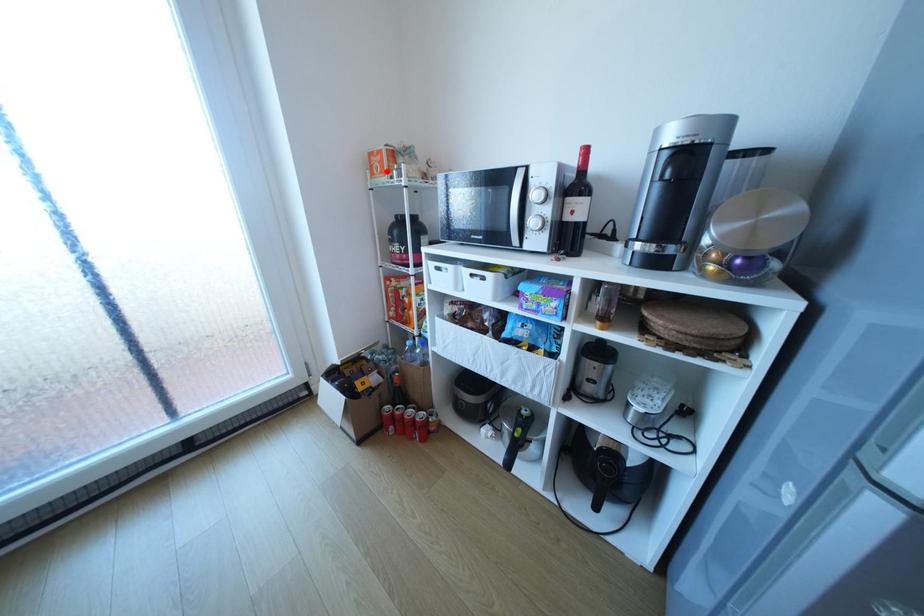
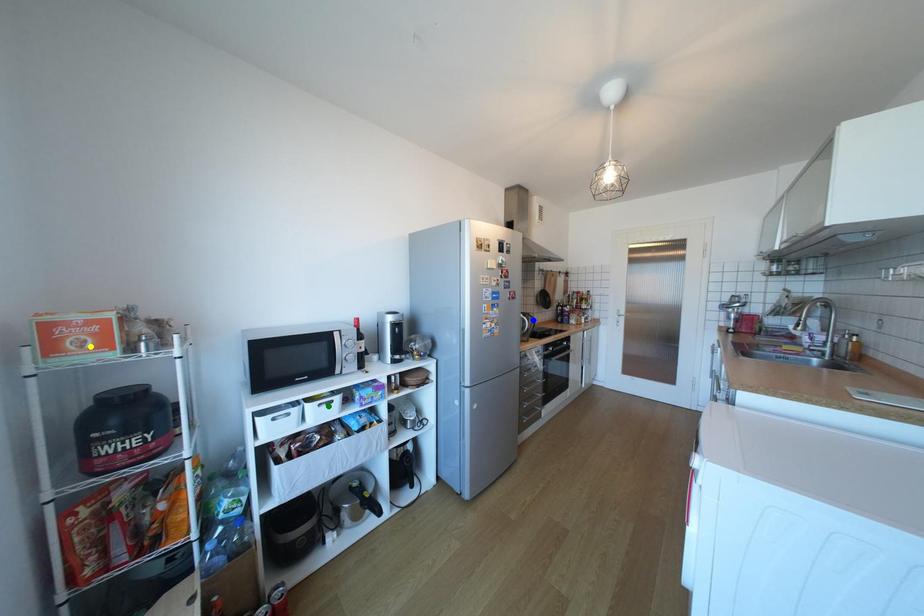
Question: I am providing you with two images of the same scene from different viewpoints. A red point is marked on the first image. You are given multiple points on the second image. Which spot in image 2 lines up with the point in image 1?

Choices:
 (A) green point
 (B) yellow point
 (C) blue point

Answer: (B)